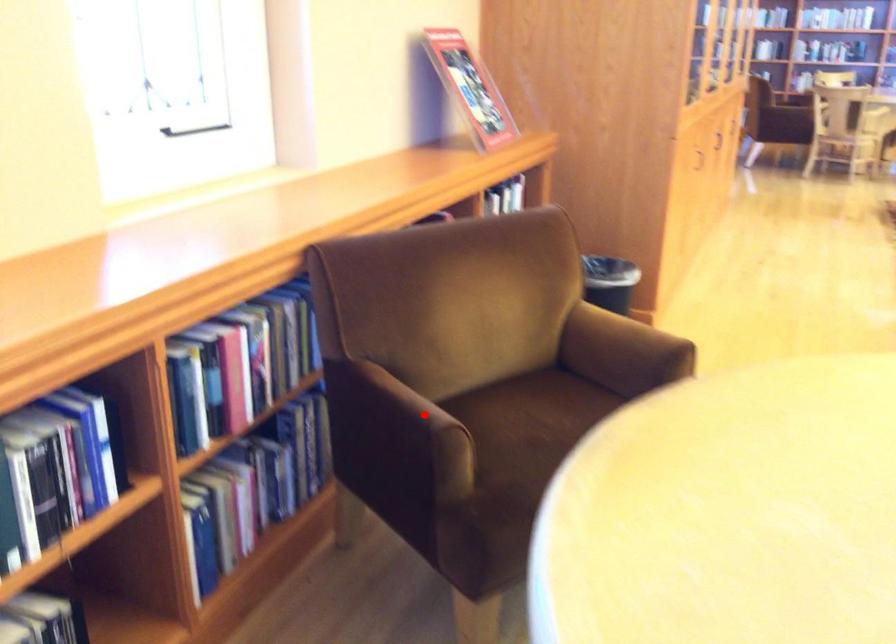
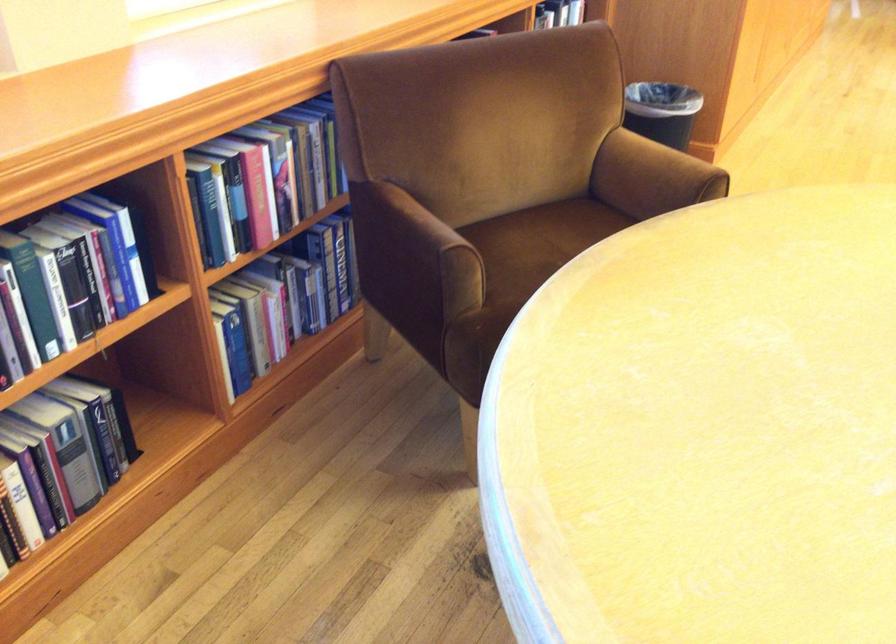
Locate, in the second image, the point that corresponds to the highlighted location in the first image.

(435, 232)